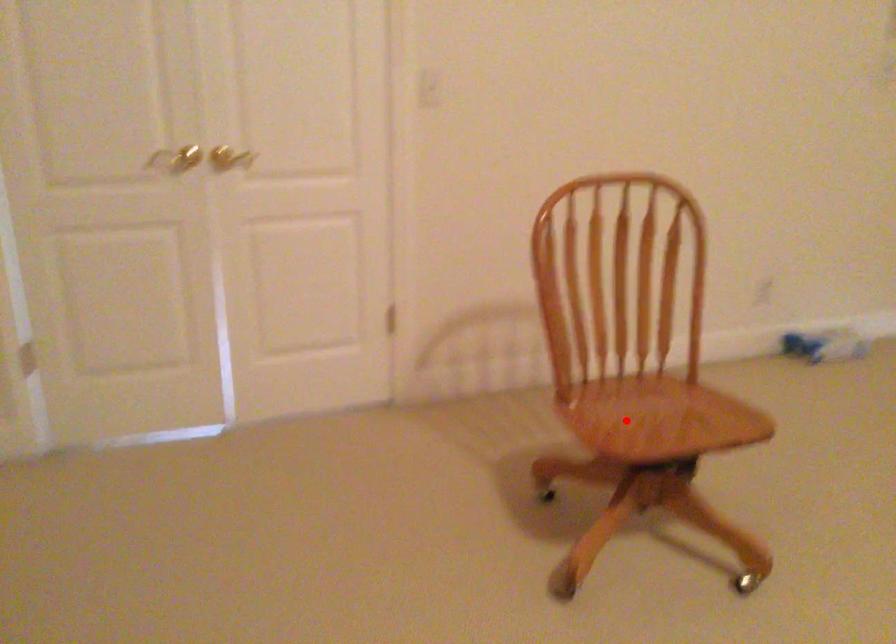
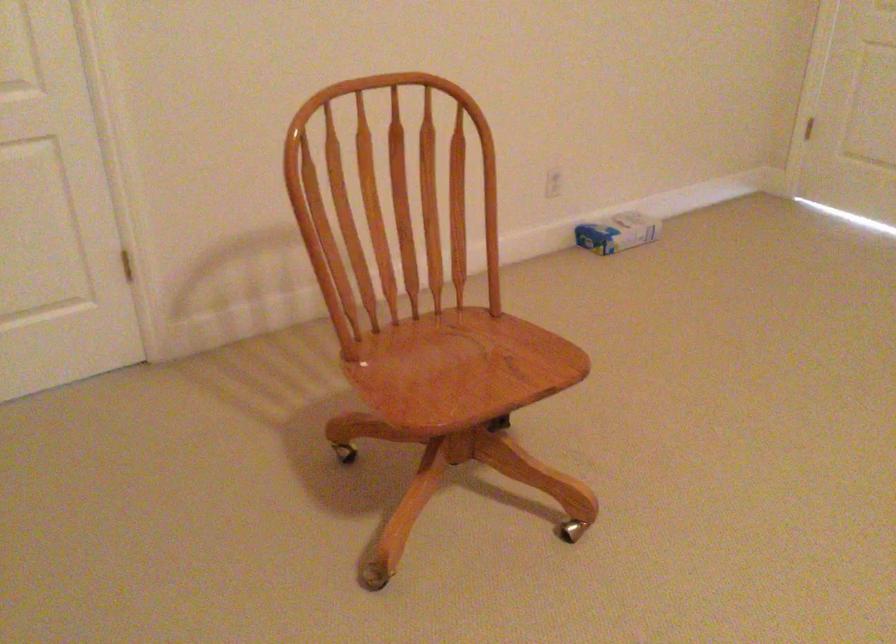
In the second image, find the point that corresponds to the highlighted location in the first image.

(428, 374)